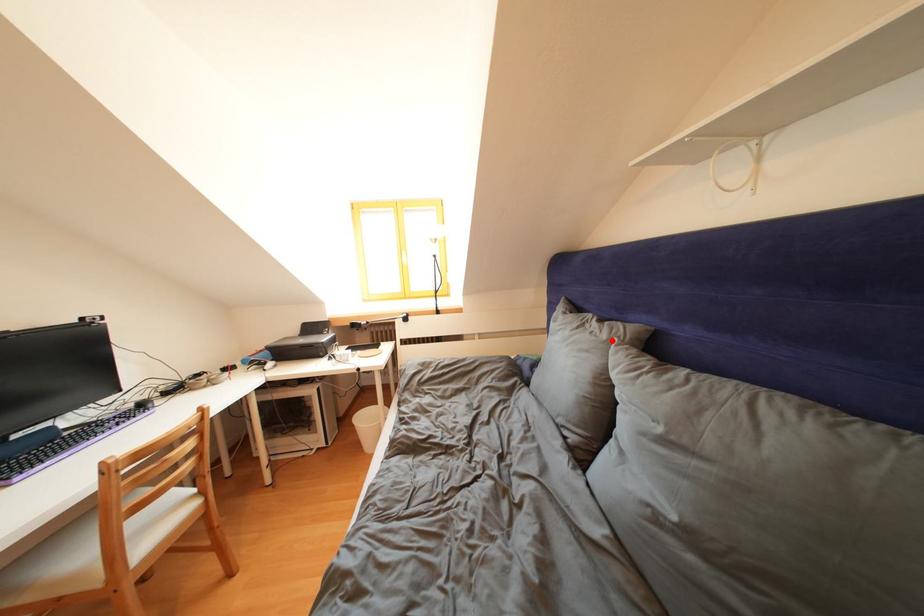
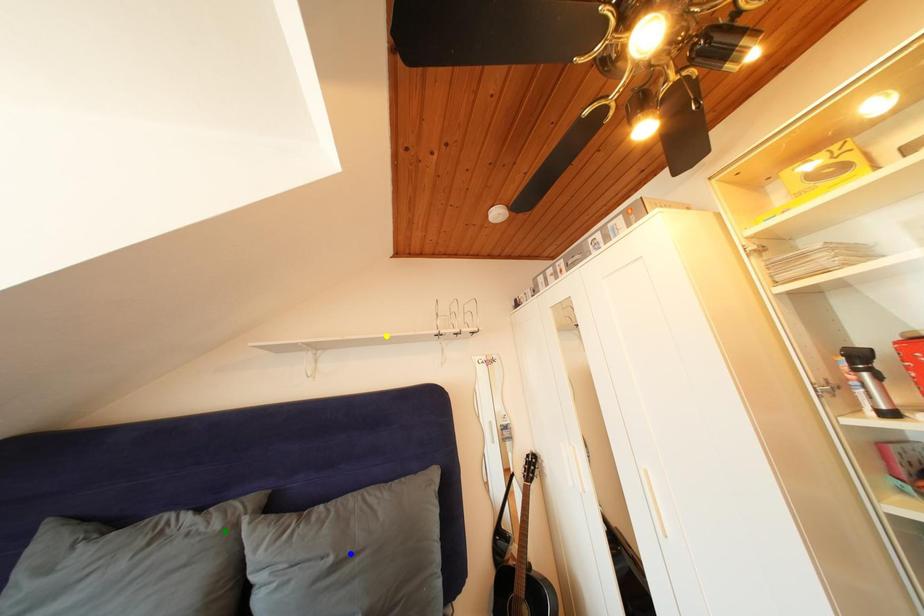
Question: I am providing you with two images of the same scene from different viewpoints. A red point is marked on the first image. You are given multiple points on the second image. Which mark in image 2 goes with the point in image 1?

Choices:
 (A) green point
 (B) yellow point
 (C) blue point

Answer: (A)